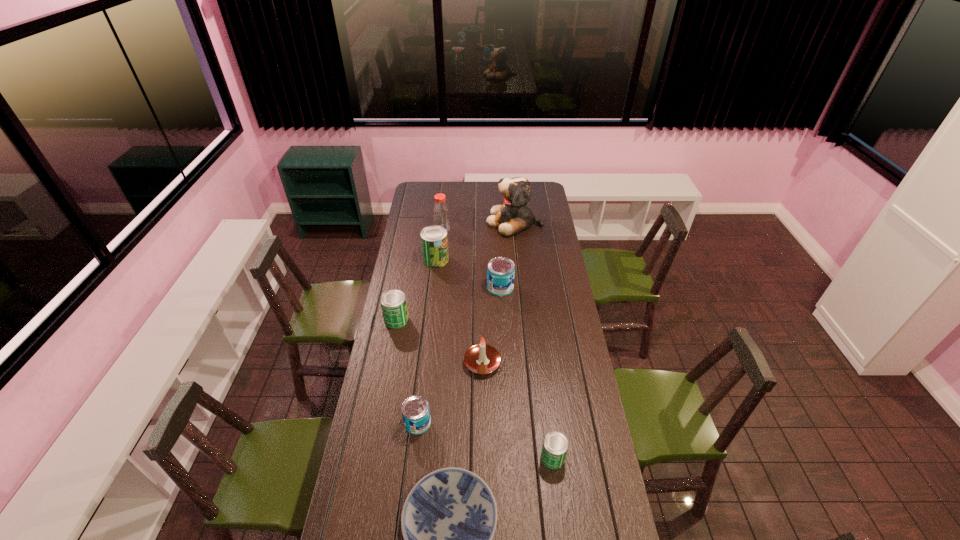
The width and height of the screenshot is (960, 540). Identify the location of the leftmost object. (393, 303).

What are the coordinates of `the nearest can` in the screenshot? It's located at (555, 445).

Where is `the smallest green can`? This screenshot has width=960, height=540. the smallest green can is located at coordinates pyautogui.click(x=555, y=445).

The width and height of the screenshot is (960, 540). I want to click on the left blue can, so click(x=415, y=409).

The width and height of the screenshot is (960, 540). Find the location of `the smaller blue can`. the smaller blue can is located at coordinates (415, 409).

Locate an element on the screen. This screenshot has width=960, height=540. vacant space located at the face of the puppy is located at coordinates (432, 222).

You are a GUI agent. You are given a task and a screenshot of the screen. Output one action in this format:
    pyautogui.click(x=<x>, y=<y>)
    Task: Click on the vacant region located 0.070m at the face of the puppy
    This screenshot has height=540, width=960.
    Given the screenshot: What is the action you would take?
    pyautogui.click(x=475, y=222)

At what (x,y) coordinates should I click in order to perform the action: click on vacant space positioned at the face of the puppy. Please return your answer as a coordinate pair (x, y). This screenshot has height=540, width=960. Looking at the image, I should click on (420, 222).

At what (x,y) coordinates should I click in order to perform the action: click on blank space located on the back of the eighth shortest object. Please return your answer as a coordinate pair (x, y). This screenshot has height=540, width=960. Looking at the image, I should click on (445, 195).

This screenshot has width=960, height=540. I want to click on blank area located 0.050m on the left of the farthest can, so (414, 259).